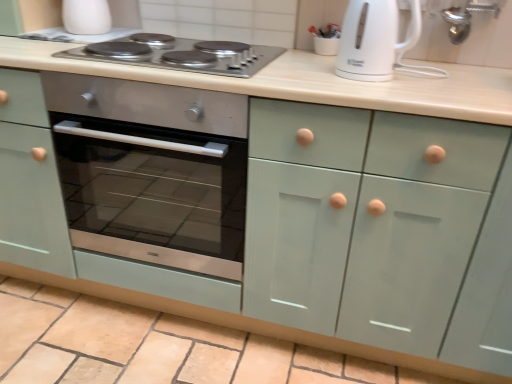
The image size is (512, 384). What do you see at coordinates (186, 66) in the screenshot?
I see `stainless steel cooktop at upper center` at bounding box center [186, 66].

Where is `satin silver oven at center`? satin silver oven at center is located at coordinates (154, 193).

Describe the element at coordinates (86, 17) in the screenshot. The width and height of the screenshot is (512, 384). I see `white glossy cup at upper left` at that location.

Identify the location of stainless steel cooktop at upper center. The image size is (512, 384). (186, 66).

From the image's perspective, between stainless steel cooktop at upper center and satin silver oven at center, which one is located above?

stainless steel cooktop at upper center is shown above in the image.

Is stainless steel cooktop at upper center at the right side of satin silver oven at center?

Indeed, stainless steel cooktop at upper center is positioned on the right side of satin silver oven at center.

From a real-world perspective, which is physically above, stainless steel cooktop at upper center or satin silver oven at center?

From a 3D spatial view, stainless steel cooktop at upper center is above.

Is white glossy cup at upper left looking in the opposite direction of white glossy electric kettle at upper right?

No, white glossy electric kettle at upper right is not at the back of white glossy cup at upper left.

Measure the distance between white glossy cup at upper left and white glossy electric kettle at upper right.

white glossy cup at upper left is 36.61 inches away from white glossy electric kettle at upper right.

Is white glossy cup at upper left in front of white glossy electric kettle at upper right?

That is False.

From the image's perspective, who appears lower, white glossy cup at upper left or white glossy electric kettle at upper right?

white glossy electric kettle at upper right appears lower in the image.

Would you say stainless steel cooktop at upper center is to the left or to the right of white glossy cup at upper left in the picture?

Clearly, stainless steel cooktop at upper center is on the right of white glossy cup at upper left in the image.

Is point (118, 40) positioned in front of point (87, 25)?

Yes, point (118, 40) is closer to viewer.

Based on their sizes in the image, would you say stainless steel cooktop at upper center is bigger or smaller than white glossy cup at upper left?

stainless steel cooktop at upper center is bigger than white glossy cup at upper left.

From the picture: Is stainless steel cooktop at upper center oriented away from white glossy cup at upper left?

No, stainless steel cooktop at upper center is not facing away from white glossy cup at upper left.

Which is more to the right, satin silver oven at center or stainless steel cooktop at upper center?

Positioned to the right is stainless steel cooktop at upper center.

Does satin silver oven at center have a greater width compared to stainless steel cooktop at upper center?

Yes, satin silver oven at center is wider than stainless steel cooktop at upper center.

Is the surface of satin silver oven at center in direct contact with stainless steel cooktop at upper center?

No, satin silver oven at center is not touching stainless steel cooktop at upper center.

Based on the photo, which point is more distant from viewer, (x=83, y=1) or (x=67, y=53)?

The point (x=83, y=1) is more distant.

Which is more to the left, white glossy cup at upper left or stainless steel cooktop at upper center?

Positioned to the left is white glossy cup at upper left.

From their relative heights in the image, would you say white glossy cup at upper left is taller or shorter than stainless steel cooktop at upper center?

white glossy cup at upper left is taller than stainless steel cooktop at upper center.

Is white glossy cup at upper left looking in the opposite direction of stainless steel cooktop at upper center?

No, stainless steel cooktop at upper center is not at the back of white glossy cup at upper left.

From a real-world perspective, which is physically below, white glossy electric kettle at upper right or white glossy cup at upper left?

white glossy cup at upper left, from a real-world perspective.

From the image's perspective, between white glossy electric kettle at upper right and white glossy cup at upper left, who is located below?

From the image's view, white glossy electric kettle at upper right is below.

How different are the orientations of white glossy electric kettle at upper right and white glossy cup at upper left in degrees?

The facing directions of white glossy electric kettle at upper right and white glossy cup at upper left are 4.51 degrees apart.

Between point (356, 30) and point (78, 32), which one is positioned in front?

The point (356, 30) is closer to the camera.

Looking at this image, is satin silver oven at center located outside white glossy cup at upper left?

satin silver oven at center is positioned outside white glossy cup at upper left.

Is satin silver oven at center positioned before white glossy cup at upper left?

Yes.

Measure the distance between satin silver oven at center and white glossy cup at upper left.

A distance of 24.98 inches exists between satin silver oven at center and white glossy cup at upper left.

Can you confirm if satin silver oven at center is taller than white glossy cup at upper left?

Correct, satin silver oven at center is much taller as white glossy cup at upper left.

Find the location of a particular element. gas stove lying on the right of satin silver oven at center is located at coordinates (186, 66).

Locate an element on the screen. Image resolution: width=512 pixels, height=384 pixels. kitchen appliance above the white glossy cup at upper left (from a real-world perspective) is located at coordinates (373, 39).

Based on the photo, which object lies nearer to the anchor point white glossy electric kettle at upper right, white glossy cup at upper left or stainless steel cooktop at upper center?

Among the two, stainless steel cooktop at upper center is located nearer to white glossy electric kettle at upper right.

From the image, which object appears to be nearer to white glossy cup at upper left, stainless steel cooktop at upper center or white glossy electric kettle at upper right?

Based on the image, stainless steel cooktop at upper center appears to be nearer to white glossy cup at upper left.

Considering their positions, is stainless steel cooktop at upper center positioned further to satin silver oven at center than white glossy cup at upper left?

white glossy cup at upper left is further to satin silver oven at center.

From the image, which object appears to be farther from stainless steel cooktop at upper center, satin silver oven at center or white glossy electric kettle at upper right?

satin silver oven at center is further to stainless steel cooktop at upper center.

From the image, which object appears to be nearer to white glossy cup at upper left, satin silver oven at center or white glossy electric kettle at upper right?

The object closer to white glossy cup at upper left is satin silver oven at center.

Looking at the image, which one is located further to white glossy cup at upper left, satin silver oven at center or stainless steel cooktop at upper center?

satin silver oven at center is positioned further to the anchor white glossy cup at upper left.

Based on their spatial positions, is white glossy cup at upper left or satin silver oven at center further from white glossy electric kettle at upper right?

Based on the image, white glossy cup at upper left appears to be further to white glossy electric kettle at upper right.

Which object lies nearer to the anchor point white glossy cup at upper left, white glossy electric kettle at upper right or stainless steel cooktop at upper center?

stainless steel cooktop at upper center is closer to white glossy cup at upper left.

This screenshot has width=512, height=384. Identify the location of oven situated between white glossy cup at upper left and white glossy electric kettle at upper right from left to right. (154, 193).

The image size is (512, 384). I want to click on gas stove between white glossy cup at upper left and white glossy electric kettle at upper right, so click(x=186, y=66).

In order to click on gas stove between white glossy cup at upper left and satin silver oven at center in the up-down direction in this screenshot , I will do `click(186, 66)`.

Find the location of a particular element. The width and height of the screenshot is (512, 384). gas stove between satin silver oven at center and white glossy electric kettle at upper right in the horizontal direction is located at coordinates (186, 66).